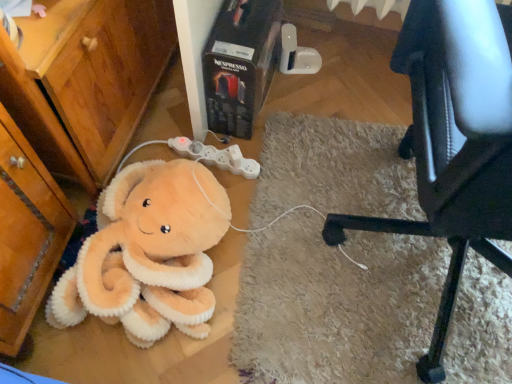
Question: Are black leather chair at lower right and soft plush octopus at lower left beside each other?

Choices:
 (A) no
 (B) yes

Answer: (A)

Question: Considering the relative sizes of black leather chair at lower right and soft plush octopus at lower left in the image provided, is black leather chair at lower right wider than soft plush octopus at lower left?

Choices:
 (A) yes
 (B) no

Answer: (A)

Question: Is the position of black leather chair at lower right less distant than that of soft plush octopus at lower left?

Choices:
 (A) yes
 (B) no

Answer: (A)

Question: Is black leather chair at lower right at the right side of soft plush octopus at lower left?

Choices:
 (A) yes
 (B) no

Answer: (A)

Question: From the image's perspective, does black leather chair at lower right appear higher than soft plush octopus at lower left?

Choices:
 (A) no
 (B) yes

Answer: (B)

Question: From a real-world perspective, is black leather chair at lower right positioned over soft plush octopus at lower left based on gravity?

Choices:
 (A) yes
 (B) no

Answer: (A)

Question: Is the depth of black leather chair at lower right greater than that of white plastic game controller at center?

Choices:
 (A) yes
 (B) no

Answer: (B)

Question: Is black leather chair at lower right shorter than white plastic game controller at center?

Choices:
 (A) no
 (B) yes

Answer: (A)

Question: From a real-world perspective, is black leather chair at lower right physically above white plastic game controller at center?

Choices:
 (A) yes
 (B) no

Answer: (A)

Question: Is black leather chair at lower right surrounding white plastic game controller at center?

Choices:
 (A) no
 (B) yes

Answer: (A)

Question: Is black leather chair at lower right far from white plastic game controller at center?

Choices:
 (A) no
 (B) yes

Answer: (A)

Question: From the image's perspective, is black leather chair at lower right located above white plastic game controller at center?

Choices:
 (A) no
 (B) yes

Answer: (A)

Question: Is white plastic game controller at center aimed at soft plush octopus at lower left?

Choices:
 (A) no
 (B) yes

Answer: (B)